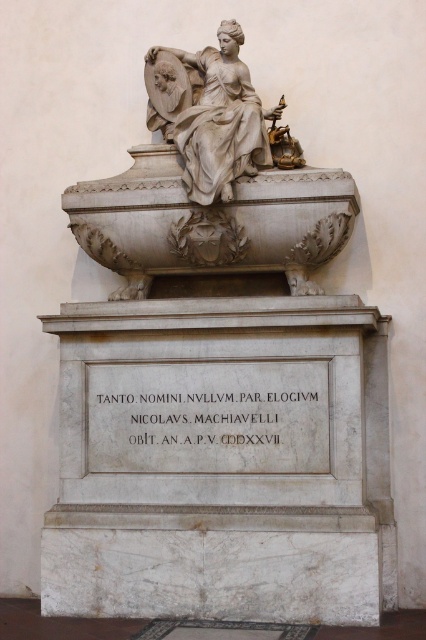
Question: Which of the following is the farthest from the observer?

Choices:
 (A) white marble statue at center
 (B) white marble statue at upper center

Answer: (A)

Question: Observing the image, what is the correct spatial positioning of white marble statue at center in reference to white marble statue at upper center?

Choices:
 (A) below
 (B) above

Answer: (A)

Question: Does white marble statue at center appear on the left side of white marble statue at upper center?

Choices:
 (A) yes
 (B) no

Answer: (B)

Question: Is white marble statue at center smaller than white marble statue at upper center?

Choices:
 (A) no
 (B) yes

Answer: (A)